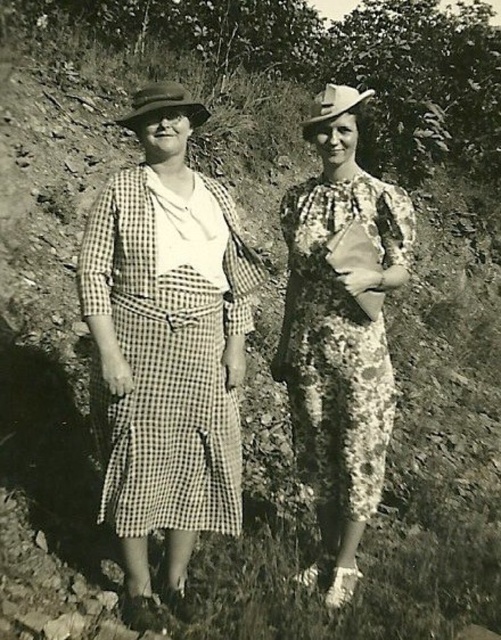
Which is above, checkered fabric dress at center or floral-patterned fabric dress at center?

floral-patterned fabric dress at center

From the picture: Measure the distance between checkered fabric dress at center and floral-patterned fabric dress at center.

59.94 centimeters

Measure the distance between point (x=218, y=381) and camera.

2.96 meters

The height and width of the screenshot is (640, 501). In order to click on checkered fabric dress at center in this screenshot , I will do `click(165, 369)`.